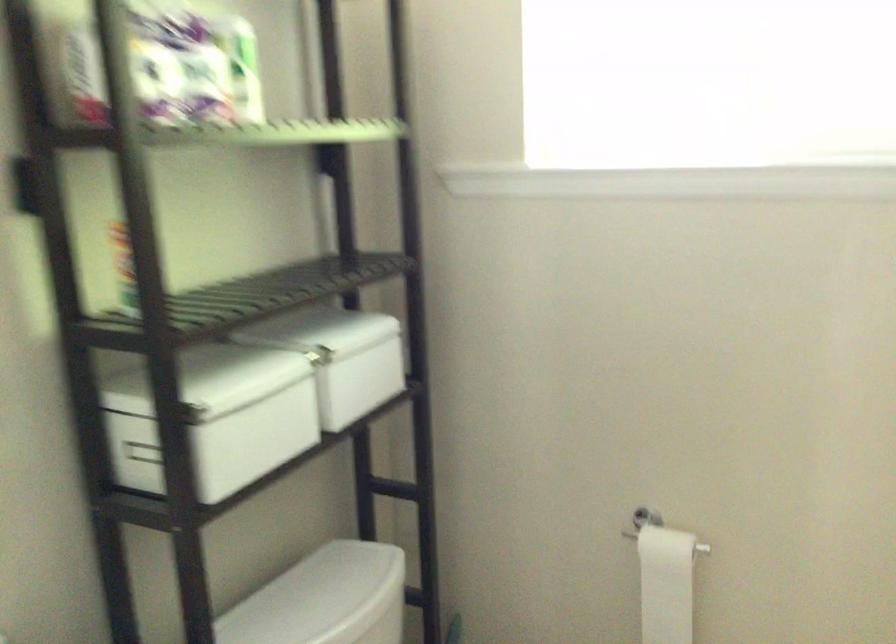
Where is `white box handle`? The image size is (896, 644). white box handle is located at coordinates (142, 451).